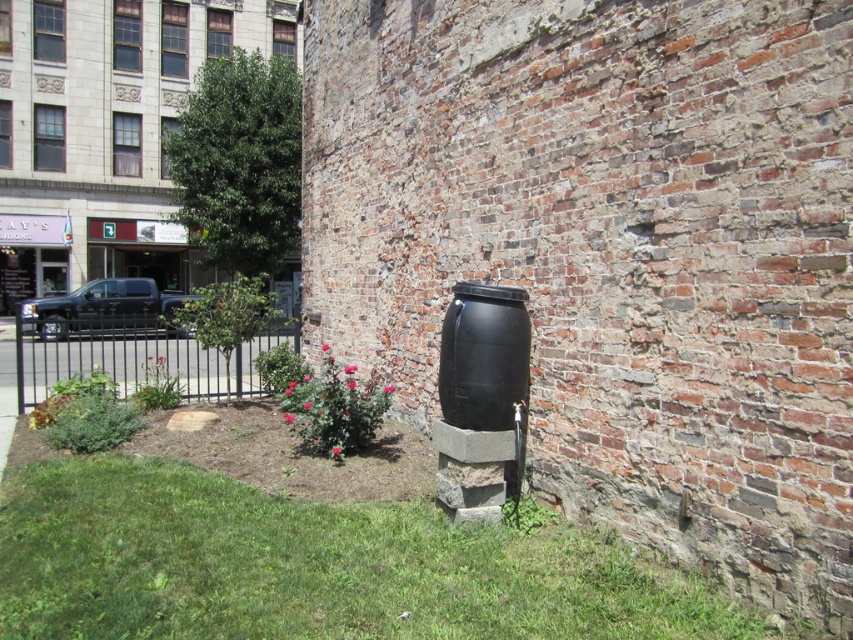
Is the position of green grass at lower center more distant than that of black metal fence at lower left?

No, it is in front of black metal fence at lower left.

Is point (531, 621) positioned behind point (91, 348)?

No, (531, 621) is closer to viewer.

Which is in front, point (38, 550) or point (129, 390)?

Positioned in front is point (38, 550).

Locate an element on the screen. The height and width of the screenshot is (640, 853). green grass at lower center is located at coordinates (314, 566).